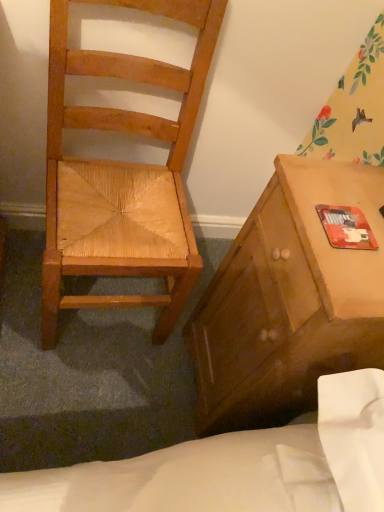
Question: From a real-world perspective, is red matte mouse pad at right on matte wooden cabinet at right?

Choices:
 (A) no
 (B) yes

Answer: (B)

Question: Can we say red matte mouse pad at right lies outside matte wooden cabinet at right?

Choices:
 (A) yes
 (B) no

Answer: (B)

Question: From the image's perspective, does red matte mouse pad at right appear higher than matte wooden cabinet at right?

Choices:
 (A) yes
 (B) no

Answer: (A)

Question: Does red matte mouse pad at right have a greater width compared to matte wooden cabinet at right?

Choices:
 (A) yes
 (B) no

Answer: (B)

Question: Is red matte mouse pad at right positioned in front of matte wooden cabinet at right?

Choices:
 (A) no
 (B) yes

Answer: (A)

Question: Is red matte mouse pad at right situated inside matte wooden cabinet at right or outside?

Choices:
 (A) inside
 (B) outside

Answer: (A)

Question: Is red matte mouse pad at right in front of or behind matte wooden cabinet at right in the image?

Choices:
 (A) behind
 (B) front

Answer: (A)

Question: In terms of height, does red matte mouse pad at right look taller or shorter compared to matte wooden cabinet at right?

Choices:
 (A) short
 (B) tall

Answer: (A)

Question: Considering the positions of red matte mouse pad at right and matte wooden cabinet at right in the image, is red matte mouse pad at right wider or thinner than matte wooden cabinet at right?

Choices:
 (A) thin
 (B) wide

Answer: (A)

Question: Is point (144, 6) closer or farther from the camera than point (349, 246)?

Choices:
 (A) closer
 (B) farther

Answer: (B)

Question: Based on their positions, is natural wood chair at left located to the left or right of red matte mouse pad at right?

Choices:
 (A) left
 (B) right

Answer: (A)

Question: Considering the positions of natural wood chair at left and red matte mouse pad at right in the image, is natural wood chair at left bigger or smaller than red matte mouse pad at right?

Choices:
 (A) small
 (B) big

Answer: (B)

Question: In terms of width, does natural wood chair at left look wider or thinner when compared to red matte mouse pad at right?

Choices:
 (A) thin
 (B) wide

Answer: (B)

Question: From their relative heights in the image, would you say matte wooden cabinet at right is taller or shorter than red matte mouse pad at right?

Choices:
 (A) tall
 (B) short

Answer: (A)

Question: Is matte wooden cabinet at right bigger or smaller than red matte mouse pad at right?

Choices:
 (A) small
 (B) big

Answer: (B)